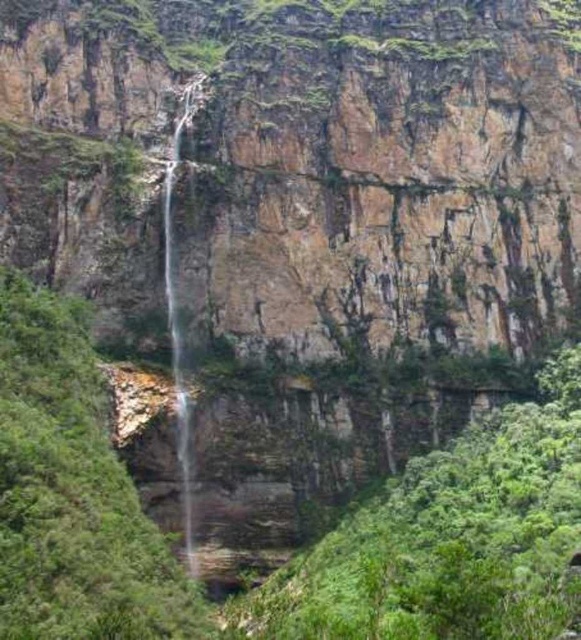
Question: Does brown rocky cliff at center appear over clear water at center?

Choices:
 (A) yes
 (B) no

Answer: (A)

Question: Which of the following is the closest to the observer?

Choices:
 (A) brown rocky cliff at center
 (B) clear water at center

Answer: (B)

Question: Which point appears closest to the camera in this image?

Choices:
 (A) (188, 452)
 (B) (303, 272)

Answer: (A)

Question: Can you confirm if brown rocky cliff at center is thinner than clear water at center?

Choices:
 (A) yes
 (B) no

Answer: (B)

Question: Can you confirm if brown rocky cliff at center is positioned to the left of clear water at center?

Choices:
 (A) no
 (B) yes

Answer: (A)